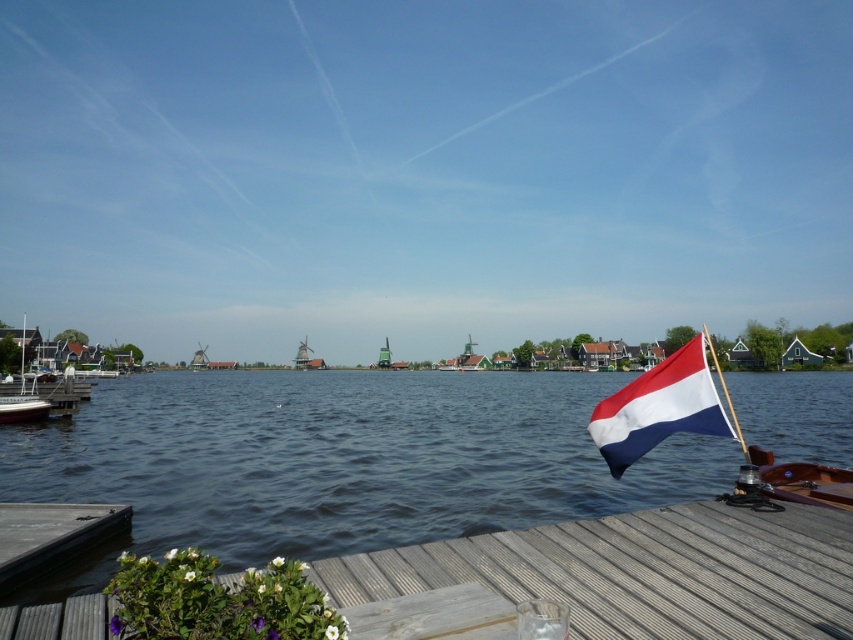
Question: Can you confirm if transparent water at lower center is thinner than white wooden boat at left?

Choices:
 (A) no
 (B) yes

Answer: (B)

Question: Which is nearer to the red-white-blue fabric flag at right?

Choices:
 (A) transparent water at lower center
 (B) wooden dock at lower left
 (C) wooden dock at lower center
 (D) white wooden boat at left

Answer: (C)

Question: Which point is farther from the camera taking this photo?

Choices:
 (A) (633, 436)
 (B) (49, 557)

Answer: (A)

Question: Does wooden dock at lower left lie behind white wooden boat at left?

Choices:
 (A) no
 (B) yes

Answer: (A)

Question: Can you confirm if transparent water at lower center is wider than wooden dock at lower center?

Choices:
 (A) yes
 (B) no

Answer: (A)

Question: Among these objects, which one is nearest to the camera?

Choices:
 (A) red-white-blue fabric flag at right
 (B) white wooden boat at left

Answer: (A)